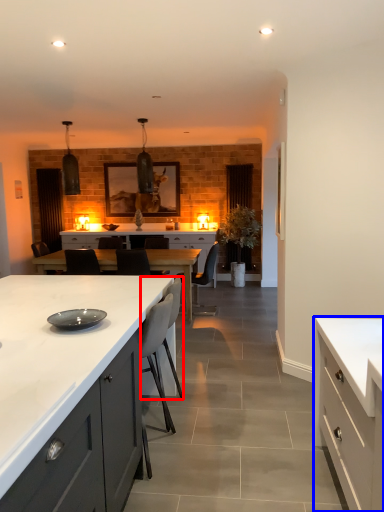
Question: Which point is closer to the camera, armchair (highlighted by a red box) or cabinetry (highlighted by a blue box)?

Choices:
 (A) armchair
 (B) cabinetry

Answer: (B)